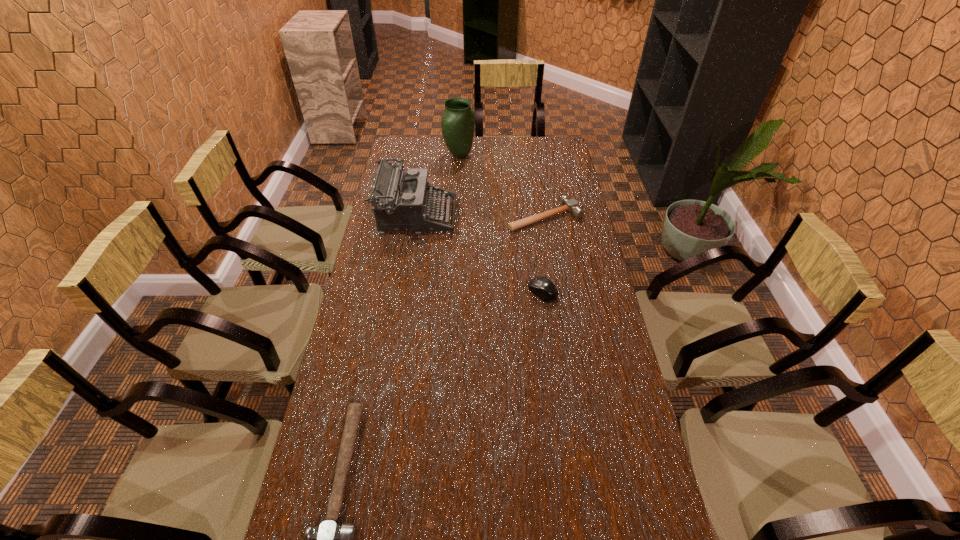
Locate an element on the screen. the tallest object is located at coordinates (458, 119).

The width and height of the screenshot is (960, 540). What are the coordinates of `vase` in the screenshot? It's located at (458, 119).

In order to click on the second tallest object in this screenshot , I will do (x=401, y=202).

You are a GUI agent. You are given a task and a screenshot of the screen. Output one action in this format:
    pyautogui.click(x=<x>, y=<y>)
    Task: Click on the second nearest object
    This screenshot has height=540, width=960.
    Given the screenshot: What is the action you would take?
    pyautogui.click(x=542, y=287)

Identify the location of the farther hammer. This screenshot has width=960, height=540. (571, 205).

The width and height of the screenshot is (960, 540). I want to click on free space located 0.170m on the left of the farthest object, so click(x=408, y=156).

Locate an element on the screen. The width and height of the screenshot is (960, 540). blank space located 0.340m on the typing side of the typewriter is located at coordinates (540, 217).

The width and height of the screenshot is (960, 540). I want to click on vacant space situated 0.250m on the back of the second nearest object, so click(x=535, y=233).

Where is `vacant space located on the left of the right hammer`? vacant space located on the left of the right hammer is located at coordinates (467, 216).

You are a GUI agent. You are given a task and a screenshot of the screen. Output one action in this format:
    pyautogui.click(x=<x>, y=<y>)
    Task: Click on the object positioned at the far edge
    The height and width of the screenshot is (540, 960).
    Given the screenshot: What is the action you would take?
    pyautogui.click(x=458, y=119)